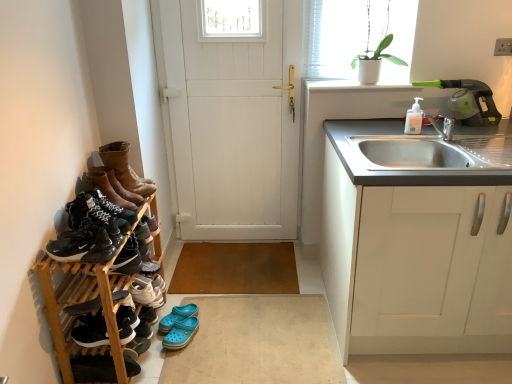
Locate an element on the screen. The width and height of the screenshot is (512, 384). vacant space behind blue rubber clogs at lower center, the 8th footwear viewed from the top is located at coordinates (180, 299).